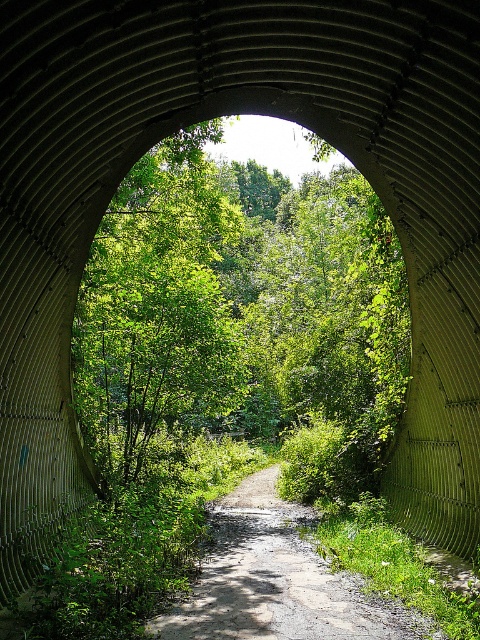
You are standing at the entrance of the tunnel structure. You want to walk towards the green leafy tree at center located at point [240,312]. Is the tunnel structure blocking your path to the tree?

The green leafy tree at center is located at point [240,312], which is at the center of the tunnel opening. Since the tunnel structure frames the scene and the tree is visible through the opening, the tunnel is not blocking your path to the tree.